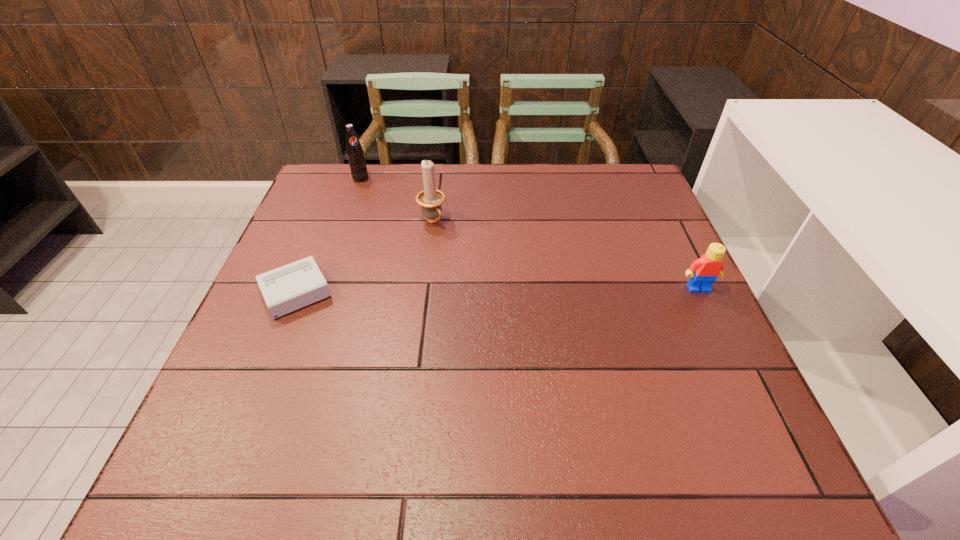
Where is `vacant region between the third tallest object and the farthest object`? The height and width of the screenshot is (540, 960). vacant region between the third tallest object and the farthest object is located at coordinates (529, 233).

Where is `free spot between the pop and the shortest object`? free spot between the pop and the shortest object is located at coordinates (328, 234).

Locate an element on the screen. vacant area that lies between the shortest object and the pop is located at coordinates (328, 234).

The image size is (960, 540). I want to click on vacant space that is in between the alarm clock and the third nearest object, so click(x=364, y=256).

Find the location of a particular element. free space between the alarm clock and the second shortest object is located at coordinates (496, 289).

You are a GUI agent. You are given a task and a screenshot of the screen. Output one action in this format:
    pyautogui.click(x=<x>, y=<y>)
    Task: Click on the free space between the third nearest object and the farthest object
    The height and width of the screenshot is (540, 960).
    Given the screenshot: What is the action you would take?
    pyautogui.click(x=396, y=200)

Where is `object that ranks as the closest to the second shortest object`? The width and height of the screenshot is (960, 540). object that ranks as the closest to the second shortest object is located at coordinates (431, 199).

Locate which object ranks third in proximity to the shortest object. Please provide its 2D coordinates. Your answer should be formatted as a tuple, i.e. [(x, y)], where the tuple contains the x and y coordinates of a point satisfying the conditions above.

[(703, 272)]

This screenshot has height=540, width=960. What are the coordinates of `vacant space that satisfies the following two spatial constraints: 1. on the back side of the third nearest object; 2. on the left side of the alarm clock` in the screenshot? It's located at (324, 221).

The image size is (960, 540). Identify the location of vacant space that satisfies the following two spatial constraints: 1. on the back side of the farthest object; 2. on the left side of the alarm clock. (341, 179).